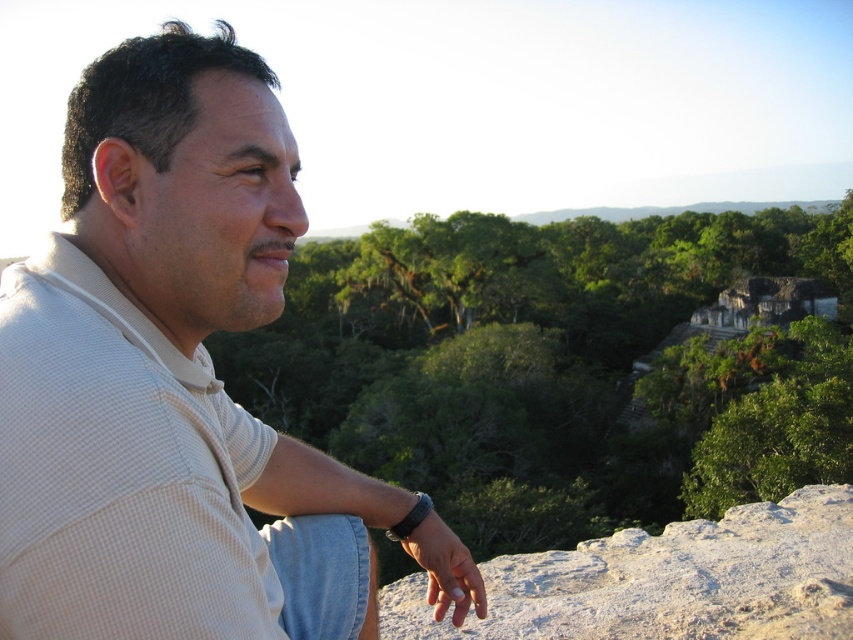
Between point (317, 332) and point (459, 560), which one is positioned in front?

Point (459, 560) is in front.

Between point (540, 528) and point (463, 600), which one is positioned behind?

Positioned behind is point (540, 528).

You are a GUI agent. You are given a task and a screenshot of the screen. Output one action in this format:
    pyautogui.click(x=<x>, y=<y>)
    Task: Click on the green leafy trees at center
    This screenshot has height=640, width=853.
    Given the screenshot: What is the action you would take?
    pyautogui.click(x=567, y=365)

At what (x,y) coordinates should I click in order to perform the action: click on white textured shirt at upper left. Please return your answer as a coordinate pair (x, y). This screenshot has height=640, width=853. Looking at the image, I should click on (169, 378).

Does white textured shirt at upper left have a greater height compared to black leather watch at lower center?

Correct, white textured shirt at upper left is much taller as black leather watch at lower center.

Does point (49, 400) lie behind point (422, 566)?

No, (49, 400) is in front of (422, 566).

What are the coordinates of `white textured shirt at upper left` in the screenshot? It's located at (169, 378).

Between white textured shirt at upper left and white rough stone at center, which one is positioned lower?

white rough stone at center

Looking at this image, which of these two, white textured shirt at upper left or white rough stone at center, stands shorter?

white rough stone at center is shorter.

The image size is (853, 640). Identify the location of white textured shirt at upper left. [169, 378].